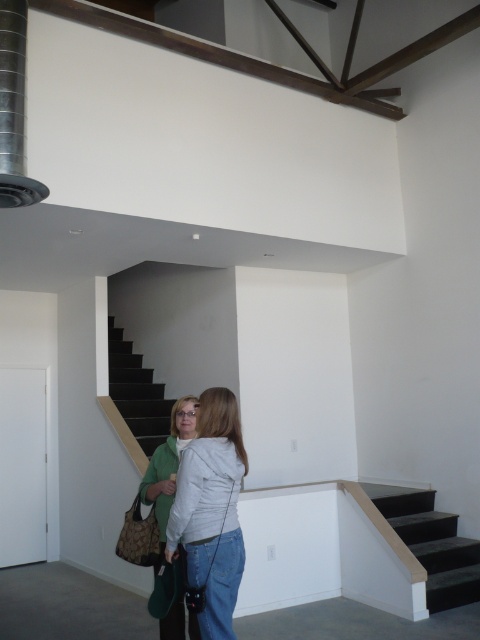
You are a delivery person carrying a large package and need to place it on the floor. You see the white matte jacket at center and the black matte stairwell at center. Which object is closer to you, and can you safely place the package between them without blocking the stairwell?

The white matte jacket at center and black matte stairwell at center are 12.22 feet apart. Since the distance is sufficient, you can safely place the package between them without blocking the stairwell, provided you ensure it doesn

You are a delivery person who needs to carry a large package up the dark gray carpeted stairs at lower right. The package is as tall as the green fabric jacket at lower left. Will the package fit through the staircase?

The dark gray carpeted stairs at lower right has a lesser height compared to green fabric jacket at lower left. Since the package is as tall as the green fabric jacket at lower left, it may not fit through the staircase because the staircase has a lower height than the package.